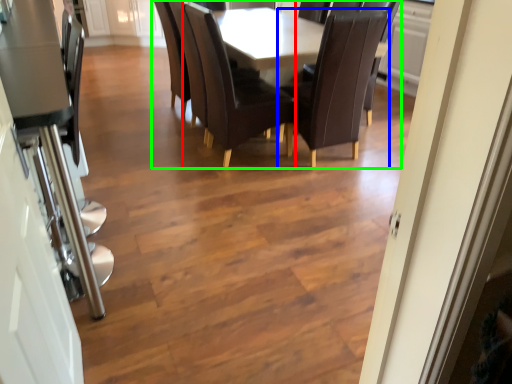
Question: Considering the real-world distances, which object is closest to chair (highlighted by a red box)? chair (highlighted by a blue box) or kitchen & dining room table (highlighted by a green box).

Choices:
 (A) chair
 (B) kitchen & dining room table

Answer: (B)